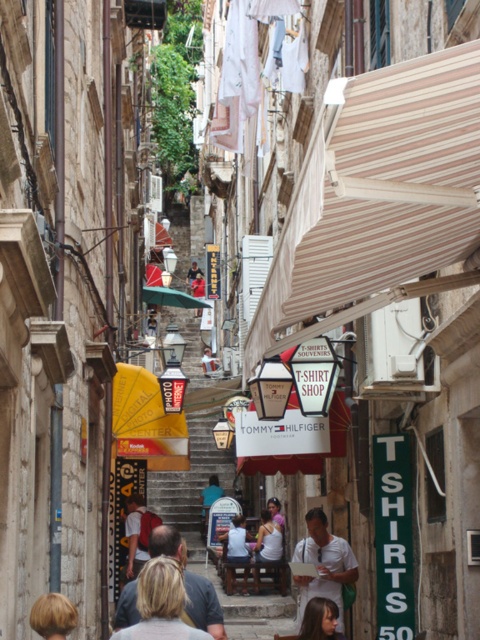
Who is positioned more to the right, light brown hair at center or blonde hair at lower left?

Positioned to the right is light brown hair at center.

Does light brown hair at center have a smaller size compared to blonde hair at lower left?

Incorrect, light brown hair at center is not smaller in size than blonde hair at lower left.

Is point (304, 582) less distant than point (56, 614)?

No.

Identify the location of light brown hair at center. (324, 564).

Who is positioned more to the left, white cotton tank top at center or white cotton shirt at center?

white cotton shirt at center is more to the left.

Locate an element on the screen. This screenshot has width=480, height=640. white cotton tank top at center is located at coordinates (267, 540).

Between point (232, 147) and point (211, 358), which one is positioned in front?

Point (232, 147) is in front.

How distant is white fabric at upper center from light blue shirt at center?

A distance of 70.09 meters exists between white fabric at upper center and light blue shirt at center.

Between point (248, 106) and point (206, 369), which one is positioned in front?

Point (248, 106) is in front.

At what (x,y) coordinates should I click in order to perform the action: click on white fabric at upper center. Please return your answer as a coordinate pair (x, y). The width and height of the screenshot is (480, 640). Looking at the image, I should click on (241, 68).